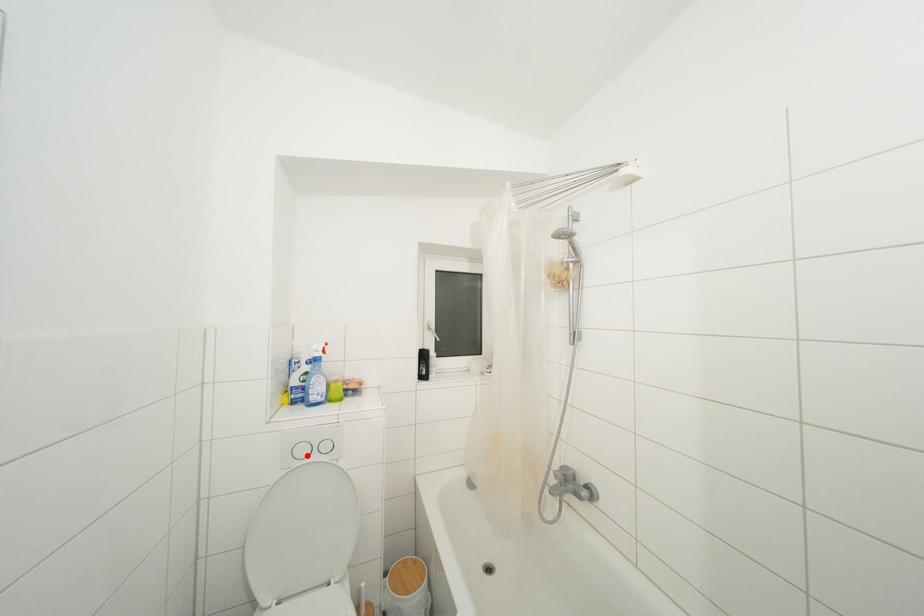
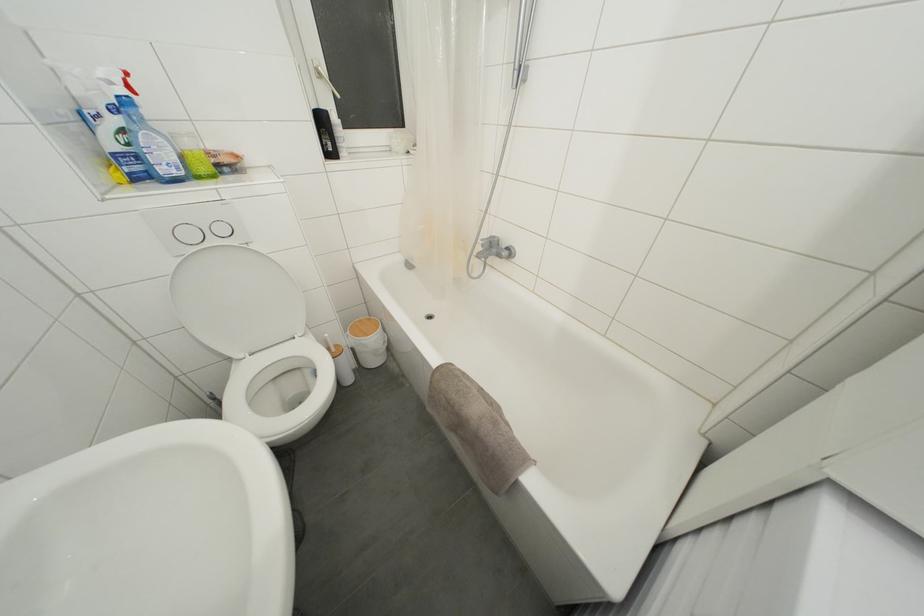
Find the pixel in the second image that matches the highlighted location in the first image.

(195, 240)